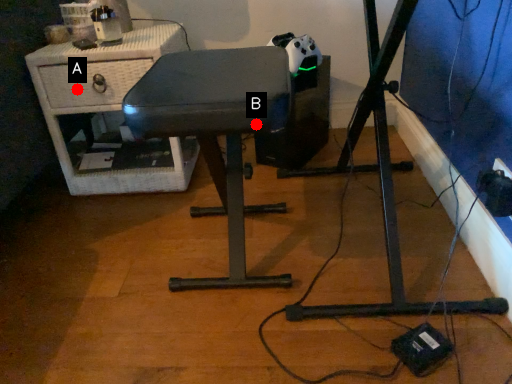
Question: Two points are circled on the image, labeled by A and B beside each circle. Among these points, which one is farthest from the camera?

Choices:
 (A) A is further
 (B) B is further

Answer: (A)